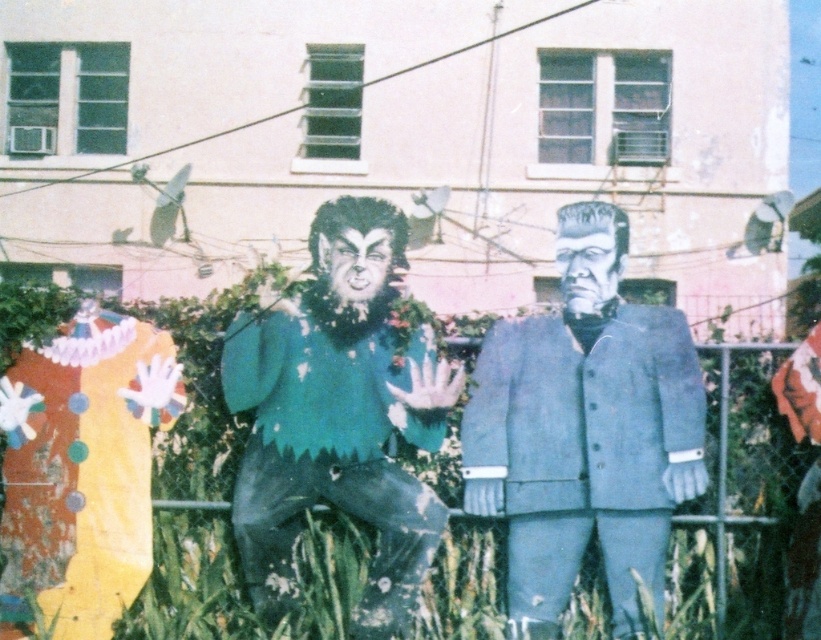
The width and height of the screenshot is (821, 640). Describe the element at coordinates (737, 502) in the screenshot. I see `metal chain-link fence at center` at that location.

Which is below, metal chain-link fence at center or green matte suit at center?

metal chain-link fence at center is lower down.

The image size is (821, 640). Find the location of `metal chain-link fence at center`. metal chain-link fence at center is located at coordinates (737, 502).

Does point (563, 364) come closer to viewer compared to point (377, 461)?

No, it is behind (377, 461).

Who is positioned more to the right, matte blue suit at center or green matte suit at center?

matte blue suit at center is more to the right.

Does point (560, 284) come behind point (283, 396)?

That is True.

Locate an element on the screen. This screenshot has width=821, height=640. matte blue suit at center is located at coordinates (585, 429).

Looking at this image, is metal chain-link fence at center below matte blue suit at center?

Yes.

Does metal chain-link fence at center appear over matte blue suit at center?

No, metal chain-link fence at center is not above matte blue suit at center.

What are the coordinates of `metal chain-link fence at center` in the screenshot? It's located at click(x=737, y=502).